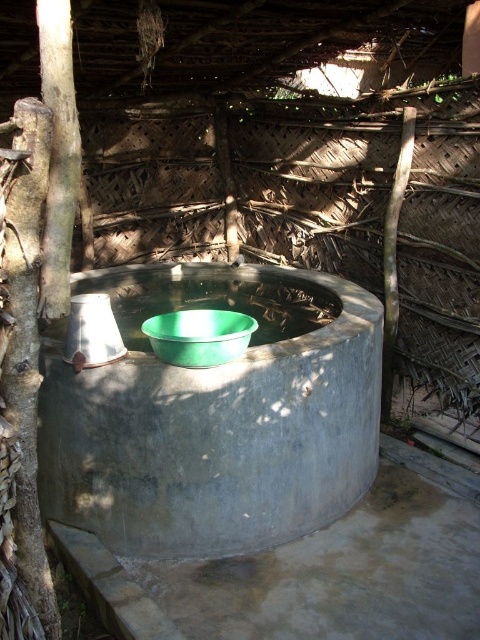
Question: Can you confirm if gray concrete basin at center is positioned to the right of green plastic basin at center?

Choices:
 (A) no
 (B) yes

Answer: (A)

Question: Among these objects, which one is farthest from the camera?

Choices:
 (A) green plastic basin at center
 (B) gray concrete basin at center

Answer: (B)

Question: Which object appears closest to the camera in this image?

Choices:
 (A) gray concrete basin at center
 (B) green plastic basin at center

Answer: (B)

Question: Which point appears farthest from the camera in this image?

Choices:
 (A) click(x=163, y=330)
 (B) click(x=296, y=422)

Answer: (B)

Question: Observing the image, what is the correct spatial positioning of gray concrete basin at center in reference to green plastic basin at center?

Choices:
 (A) right
 (B) left

Answer: (B)

Question: Does gray concrete basin at center appear on the left side of green plastic basin at center?

Choices:
 (A) yes
 (B) no

Answer: (A)